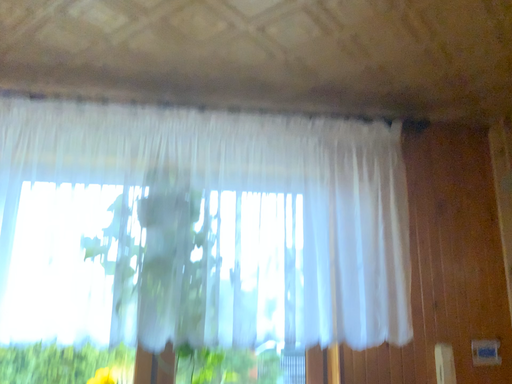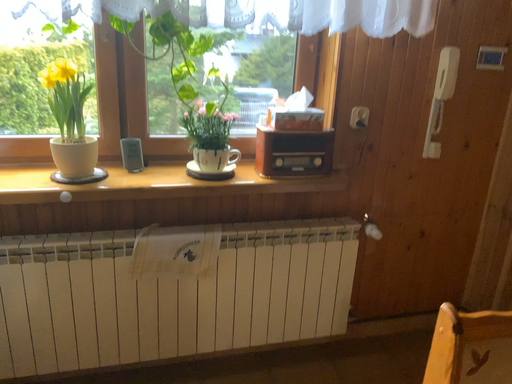
Question: How did the camera likely rotate when shooting the video?

Choices:
 (A) rotated downward
 (B) rotated upward

Answer: (A)